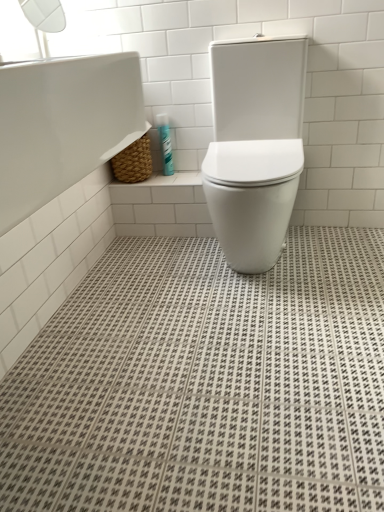
Question: From the image's perspective, is white glossy toilet at center under white glossy bathtub at upper left?

Choices:
 (A) yes
 (B) no

Answer: (B)

Question: Does white glossy toilet at center appear on the left side of white glossy bathtub at upper left?

Choices:
 (A) yes
 (B) no

Answer: (B)

Question: From a real-world perspective, is white glossy toilet at center positioned over white glossy bathtub at upper left based on gravity?

Choices:
 (A) no
 (B) yes

Answer: (A)

Question: Does white glossy toilet at center come behind white glossy bathtub at upper left?

Choices:
 (A) yes
 (B) no

Answer: (A)

Question: From a real-world perspective, is white glossy toilet at center positioned under white glossy bathtub at upper left based on gravity?

Choices:
 (A) no
 (B) yes

Answer: (B)

Question: Considering the positions of point (97, 232) and point (105, 41), is point (97, 232) closer or farther from the camera than point (105, 41)?

Choices:
 (A) closer
 (B) farther

Answer: (B)

Question: In terms of width, does white glossy bathtub at upper left look wider or thinner when compared to transparent plastic window screen at upper left?

Choices:
 (A) wide
 (B) thin

Answer: (A)

Question: Considering their positions, is white glossy bathtub at upper left located in front of or behind transparent plastic window screen at upper left?

Choices:
 (A) front
 (B) behind

Answer: (A)

Question: Is white glossy bathtub at upper left taller or shorter than transparent plastic window screen at upper left?

Choices:
 (A) short
 (B) tall

Answer: (B)

Question: Is point (28, 204) closer or farther from the camera than point (157, 122)?

Choices:
 (A) farther
 (B) closer

Answer: (B)

Question: Is white glossy bathtub at upper left wider or thinner than teal plastic toothpaste tube at upper center?

Choices:
 (A) wide
 (B) thin

Answer: (A)

Question: In the image, is white glossy bathtub at upper left positioned in front of or behind teal plastic toothpaste tube at upper center?

Choices:
 (A) front
 (B) behind

Answer: (A)

Question: Is white glossy bathtub at upper left taller or shorter than teal plastic toothpaste tube at upper center?

Choices:
 (A) short
 (B) tall

Answer: (B)

Question: Do you think transparent plastic window screen at upper left is within white glossy toilet at center, or outside of it?

Choices:
 (A) inside
 (B) outside

Answer: (B)

Question: Does point (31, 42) appear closer or farther from the camera than point (284, 84)?

Choices:
 (A) farther
 (B) closer

Answer: (A)